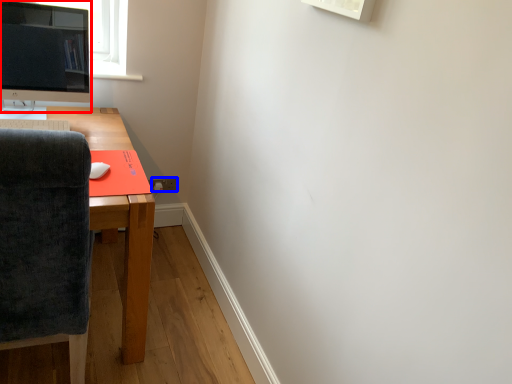
Question: Which object is further to the camera taking this photo, computer monitor (highlighted by a red box) or power outlet (highlighted by a blue box)?

Choices:
 (A) computer monitor
 (B) power outlet

Answer: (B)